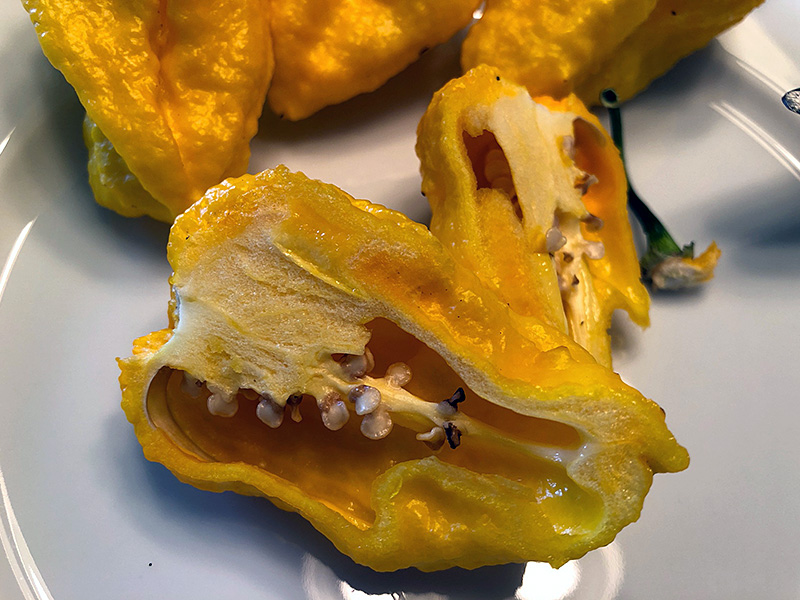
The width and height of the screenshot is (800, 600). I want to click on gray plate, so click(x=100, y=312).